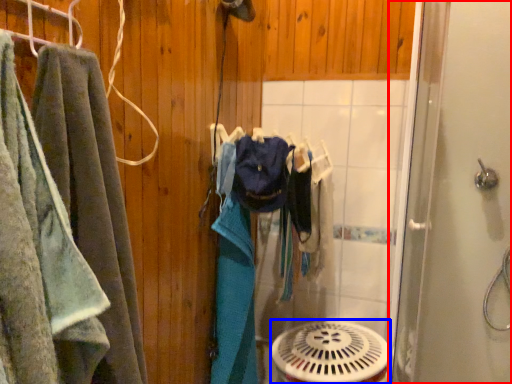
Question: Which of the following is the farthest to the observer, screen door (highlighted by a red box) or mechanical fan (highlighted by a blue box)?

Choices:
 (A) screen door
 (B) mechanical fan

Answer: (B)